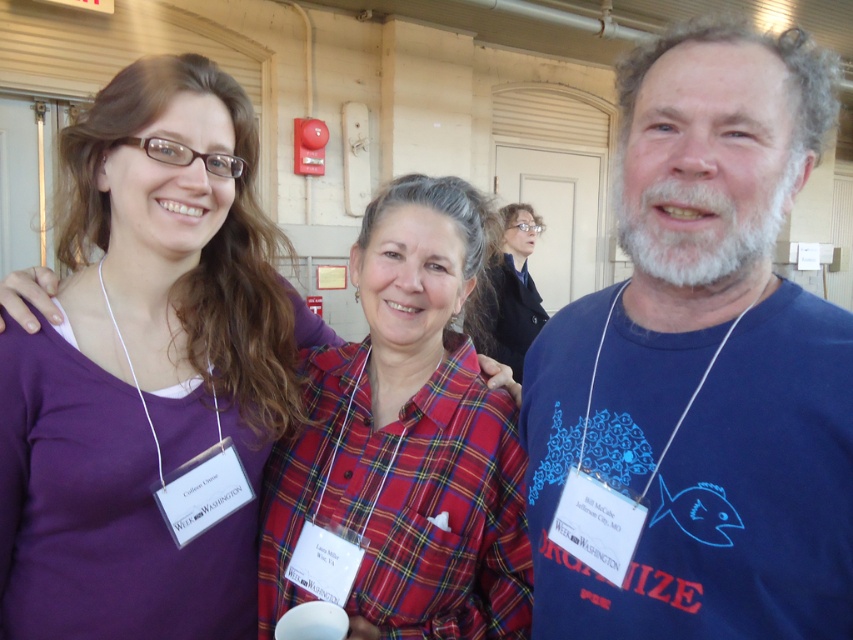
You are a photographer at a conference and want to capture a photo where the purple fabric shirt at upper left and the plaid fabric shirt at center are both visible. Given their positions, which shirt should you focus on first to ensure both are in frame?

The purple fabric shirt at upper left is below the plaid fabric shirt at center, so you should focus on the plaid fabric shirt at center first to ensure both are in frame.